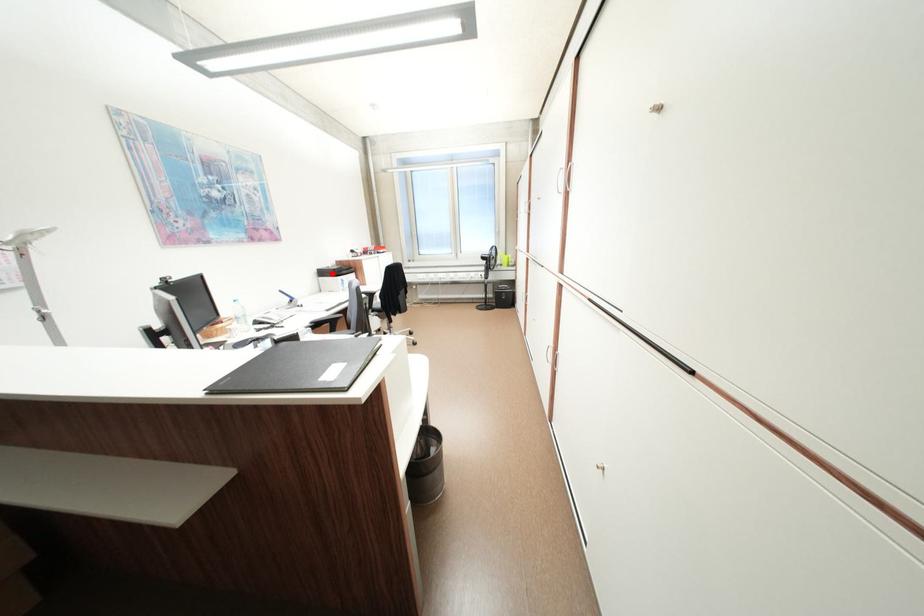
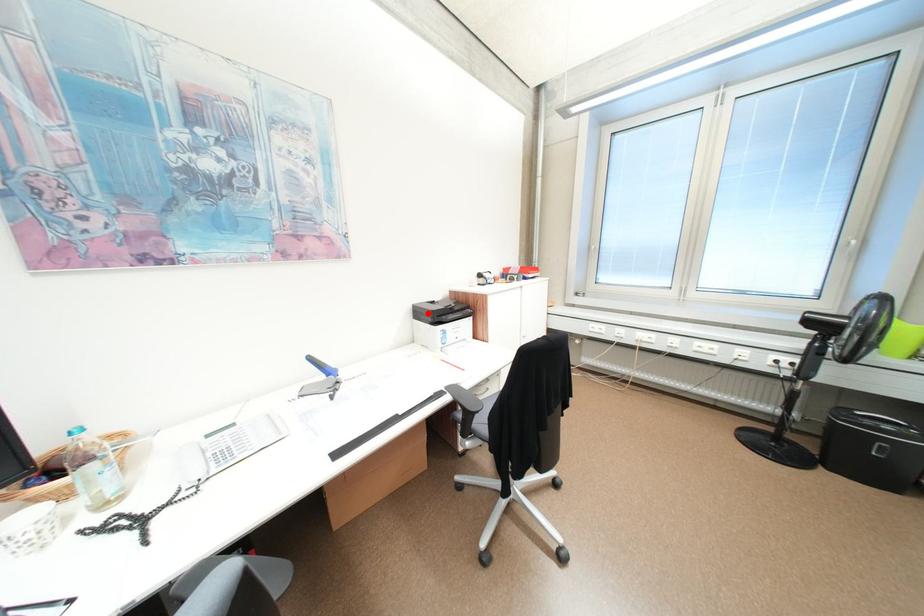
I am providing you with two images of the same scene from different viewpoints. A red point is marked on the first image and another point is marked on the second image. Is the marked point in image1 the same physical position as the marked point in image2?

Yes